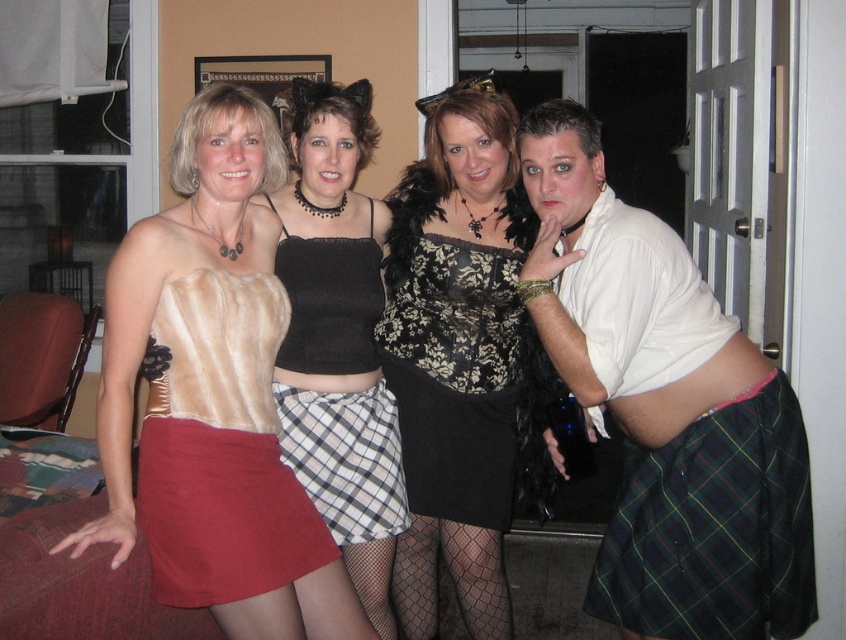
Question: Observing the image, what is the correct spatial positioning of black lace dress at center in reference to black lace top at center?

Choices:
 (A) below
 (B) above

Answer: (A)

Question: Which point is farther to the camera?

Choices:
 (A) plaid fabric skirt at center
 (B) black lace top at center
 (C) black lace dress at center
 (D) matte white shirt at right

Answer: (C)

Question: Where is black lace dress at center located in relation to pink fabric at lower right in the image?

Choices:
 (A) above
 (B) below

Answer: (A)

Question: Does satin skirt at lower left lie behind plaid fabric skirt at center?

Choices:
 (A) no
 (B) yes

Answer: (A)

Question: Which of these objects is positioned closest to the black lace top at center?

Choices:
 (A) satin skirt at lower left
 (B) matte white shirt at right

Answer: (A)

Question: Estimate the real-world distances between objects in this image. Which object is closer to the pink fabric at lower right?

Choices:
 (A) black lace dress at center
 (B) suede skirt at lower left

Answer: (A)